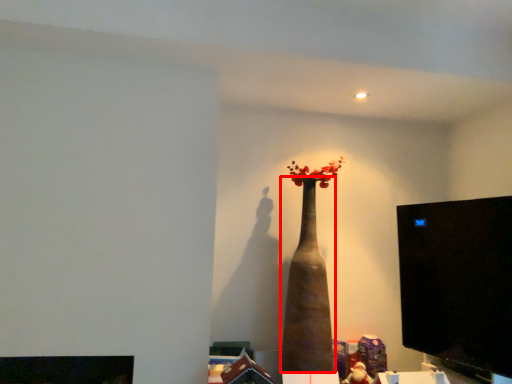
Question: From the image's perspective, considering the relative positions of vase (annotated by the red box) and computer monitor in the image provided, where is vase (annotated by the red box) located with respect to the staircase?

Choices:
 (A) below
 (B) above

Answer: (A)